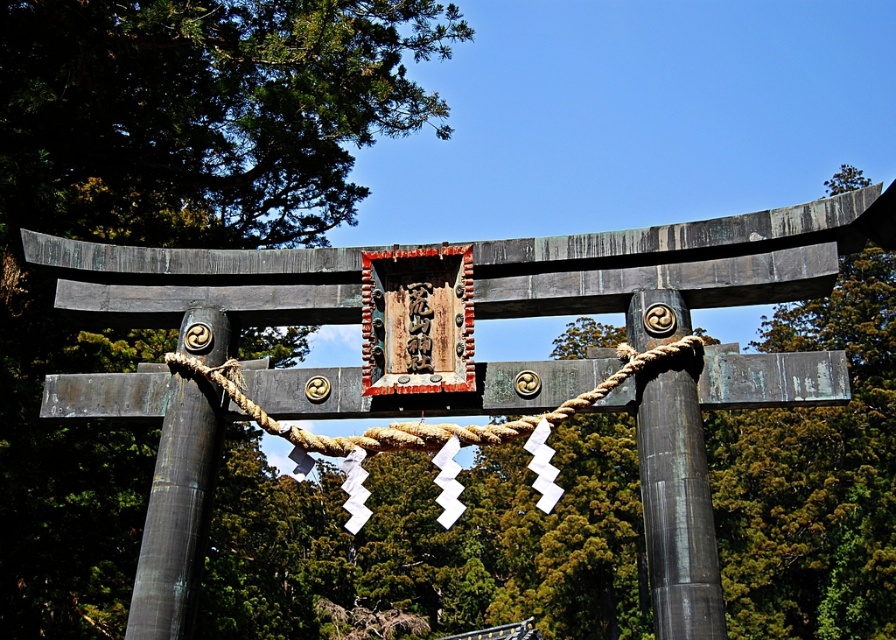
Question: Can you confirm if smooth dark wood post at center is smaller than rope at center?

Choices:
 (A) yes
 (B) no

Answer: (A)

Question: Which is nearer to the bronze textured pole at center?

Choices:
 (A) smooth dark wood post at center
 (B) rope at center

Answer: (B)

Question: Considering the relative positions of bronze textured pole at center and rope at center in the image provided, where is bronze textured pole at center located with respect to rope at center?

Choices:
 (A) above
 (B) below

Answer: (B)

Question: Which of the following is the closest to the observer?

Choices:
 (A) (179, 525)
 (B) (177, 358)
 (C) (664, 394)

Answer: (C)

Question: Which object appears closest to the camera in this image?

Choices:
 (A) rope at center
 (B) bronze textured pole at center
 (C) smooth dark wood post at center

Answer: (C)

Question: Is smooth dark wood post at center below rope at center?

Choices:
 (A) yes
 (B) no

Answer: (A)